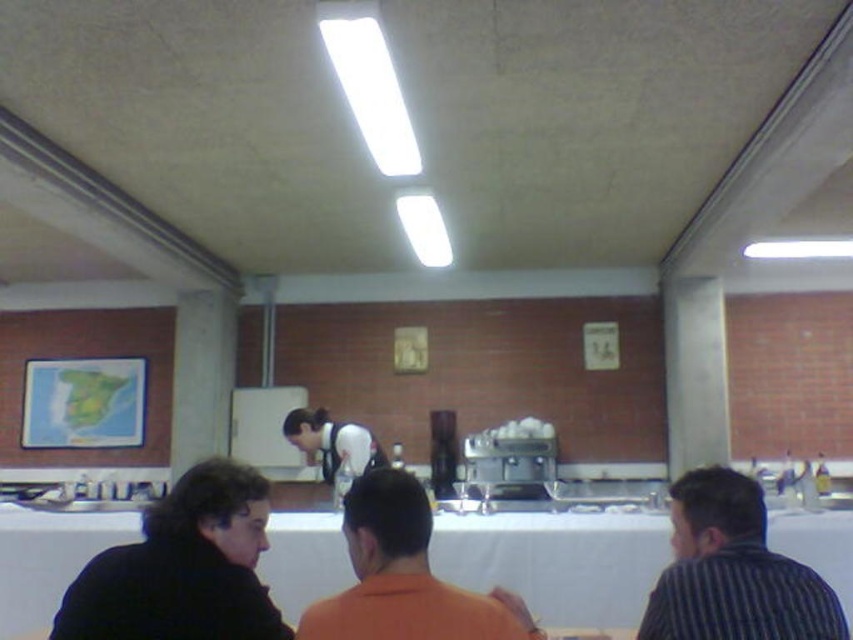
This screenshot has width=853, height=640. I want to click on white fabric table at lower center, so [558, 561].

Between white fabric table at lower center and white fabric apron at center, which one appears on the right side from the viewer's perspective?

white fabric table at lower center

Does point (3, 618) come farther from viewer compared to point (358, 461)?

No, (3, 618) is in front of (358, 461).

Identify the location of white fabric table at lower center. (558, 561).

Is striped shirt at right to the right of white fabric apron at center from the viewer's perspective?

Yes, striped shirt at right is to the right of white fabric apron at center.

Does point (682, 500) come closer to viewer compared to point (339, 435)?

Yes, point (682, 500) is in front of point (339, 435).

You are a GUI agent. You are given a task and a screenshot of the screen. Output one action in this format:
    pyautogui.click(x=<x>, y=<y>)
    Task: Click on the striped shirt at right
    This screenshot has width=853, height=640.
    Given the screenshot: What is the action you would take?
    pyautogui.click(x=733, y=570)

Can you confirm if striped shirt at right is wider than orange matte shirt at center?

In fact, striped shirt at right might be narrower than orange matte shirt at center.

Does point (815, 604) come closer to viewer compared to point (415, 528)?

No, it is behind (415, 528).

Where is `striped shirt at right`? striped shirt at right is located at coordinates (733, 570).